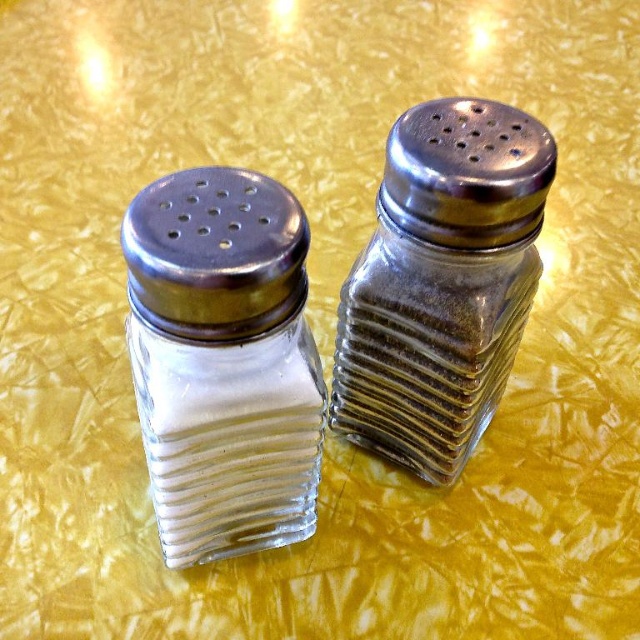
Question: Is clear glass salt shaker at left to the left of clear glass pepper shaker at right from the viewer's perspective?

Choices:
 (A) no
 (B) yes

Answer: (B)

Question: Among these points, which one is nearest to the camera?

Choices:
 (A) (220, 208)
 (B) (504, 369)

Answer: (A)

Question: Which object is farther from the camera taking this photo?

Choices:
 (A) clear glass pepper shaker at right
 (B) clear glass salt shaker at left

Answer: (A)

Question: Can you confirm if clear glass salt shaker at left is thinner than clear glass pepper shaker at right?

Choices:
 (A) no
 (B) yes

Answer: (B)

Question: Is clear glass salt shaker at left further to the viewer compared to clear glass pepper shaker at right?

Choices:
 (A) yes
 (B) no

Answer: (B)